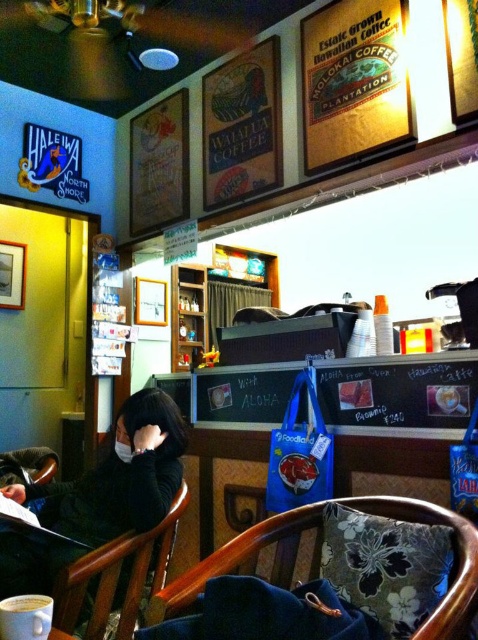
Question: Is the position of wooden chair at lower center more distant than that of wooden chair at lower left?

Choices:
 (A) no
 (B) yes

Answer: (A)

Question: Which point is closer to the camera?

Choices:
 (A) wooden chair at lower left
 (B) wooden chair at lower center
 (C) white matte cup at center

Answer: (B)

Question: Can you confirm if black matte jacket at center is thinner than wooden chair at lower left?

Choices:
 (A) yes
 (B) no

Answer: (B)

Question: Which point is farther to the camera?

Choices:
 (A) (32, 600)
 (B) (88, 545)

Answer: (B)

Question: Which object appears closest to the camera in this image?

Choices:
 (A) wooden chair at lower left
 (B) wooden chair at lower center

Answer: (B)

Question: Does wooden chair at lower center appear on the left side of wooden chair at lower left?

Choices:
 (A) yes
 (B) no

Answer: (B)